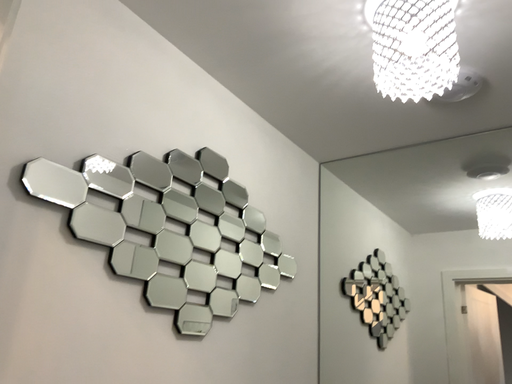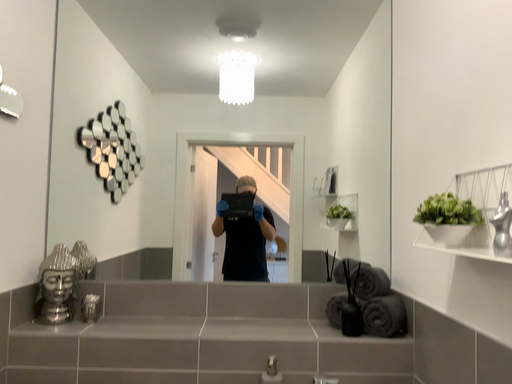
Question: Which way did the camera rotate in the video?

Choices:
 (A) rotated downward
 (B) rotated upward

Answer: (A)